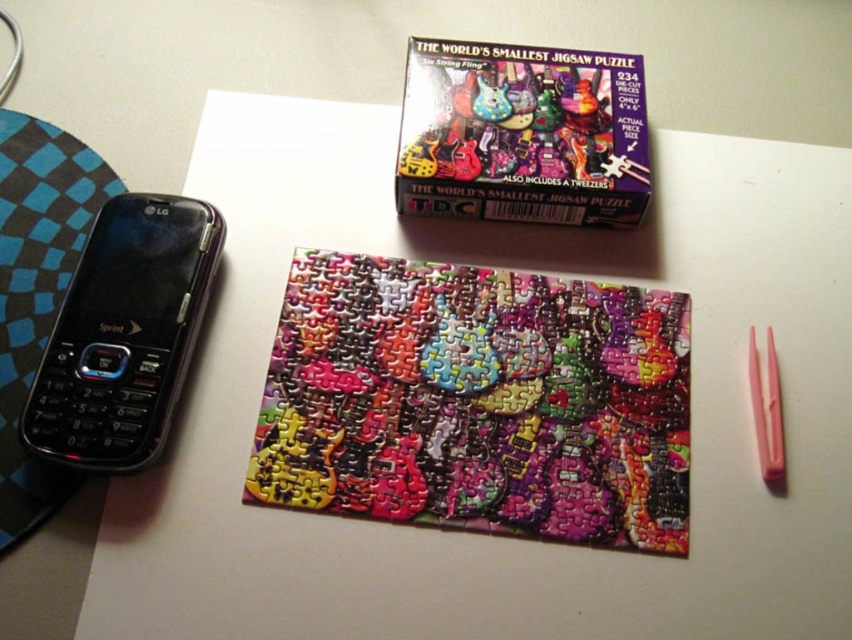
You are trying to place a new phone on the table next to the multicolored puzzle at center. The new phone is the same size as the black plastic phone at left. Will the new phone fit without overlapping the puzzle?

The multicolored puzzle at center might be wider than black plastic phone at left, so there is a possibility that the new phone will not fit without overlapping. Check the space carefully before placing it.

You are organizing items on a table and need to place a new item between the multicolored puzzle at center and the multicolored plastic box at upper center. Which object should you place the new item closer to if you want it to be near the wider object?

The multicolored puzzle at center is wider than the multicolored plastic box at upper center, so place the new item closer to the multicolored puzzle at center.